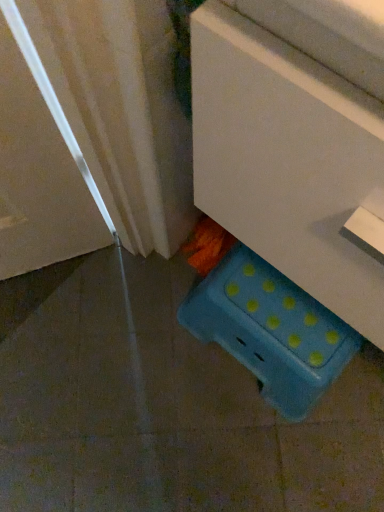
Based on the photo, in order to face blue plastic stool at lower center, should I rotate leftwards or rightwards?

To face it directly, rotate right by 29.602 degrees.

Locate an element on the screen. The height and width of the screenshot is (512, 384). blue plastic stool at lower center is located at coordinates (296, 142).

Describe the element at coordinates (296, 142) in the screenshot. I see `blue plastic stool at lower center` at that location.

Measure the distance between point (208, 339) and camera.

Point (208, 339) and camera are 34.80 inches apart from each other.

Where is `blue polka dot plastic storage box at lower right`? The image size is (384, 512). blue polka dot plastic storage box at lower right is located at coordinates (270, 330).

What do you see at coordinates (270, 330) in the screenshot?
I see `blue polka dot plastic storage box at lower right` at bounding box center [270, 330].

Locate an element on the screen. The image size is (384, 512). blue plastic stool at lower center is located at coordinates (296, 142).

Which object is positioned more to the right, blue polka dot plastic storage box at lower right or blue plastic stool at lower center?

From the viewer's perspective, blue plastic stool at lower center appears more on the right side.

In the image, is blue polka dot plastic storage box at lower right positioned in front of or behind blue plastic stool at lower center?

blue polka dot plastic storage box at lower right is positioned farther from the viewer than blue plastic stool at lower center.

Is point (331, 330) farther from camera compared to point (334, 289)?

Yes, point (331, 330) is behind point (334, 289).

From the image's perspective, which is above, blue polka dot plastic storage box at lower right or blue plastic stool at lower center?

blue plastic stool at lower center.

From a real-world perspective, which object stands above the other?

blue plastic stool at lower center.

Considering the relative sizes of blue polka dot plastic storage box at lower right and blue plastic stool at lower center in the image provided, is blue polka dot plastic storage box at lower right thinner than blue plastic stool at lower center?

Correct, the width of blue polka dot plastic storage box at lower right is less than that of blue plastic stool at lower center.

Can you confirm if blue polka dot plastic storage box at lower right is taller than blue plastic stool at lower center?

No, blue polka dot plastic storage box at lower right is not taller than blue plastic stool at lower center.

Does blue polka dot plastic storage box at lower right have a smaller size compared to blue plastic stool at lower center?

Correct, blue polka dot plastic storage box at lower right occupies less space than blue plastic stool at lower center.

Is blue polka dot plastic storage box at lower right situated inside blue plastic stool at lower center or outside?

blue polka dot plastic storage box at lower right is not enclosed by blue plastic stool at lower center.

Is there a large distance between blue polka dot plastic storage box at lower right and blue plastic stool at lower center?

No, blue polka dot plastic storage box at lower right is not far away from blue plastic stool at lower center.

Is blue polka dot plastic storage box at lower right facing towards blue plastic stool at lower center?

No, blue polka dot plastic storage box at lower right is not aimed at blue plastic stool at lower center.

Can you tell me how much blue polka dot plastic storage box at lower right and blue plastic stool at lower center differ in facing direction?

0.000554 degrees separate the facing orientations of blue polka dot plastic storage box at lower right and blue plastic stool at lower center.

Identify the location of furniture above the blue polka dot plastic storage box at lower right (from a real-world perspective). (296, 142).

Between blue plastic stool at lower center and blue polka dot plastic storage box at lower right, which one appears on the right side from the viewer's perspective?

blue plastic stool at lower center.

Considering the relative positions of blue plastic stool at lower center and blue polka dot plastic storage box at lower right in the image provided, is blue plastic stool at lower center in front of blue polka dot plastic storage box at lower right?

Yes, blue plastic stool at lower center is closer to the camera.

Does point (205, 10) come farther from viewer compared to point (304, 300)?

No, it is not.

From the picture: From the image's perspective, is blue plastic stool at lower center positioned above or below blue polka dot plastic storage box at lower right?

blue plastic stool at lower center is situated higher than blue polka dot plastic storage box at lower right in the image.

From a real-world perspective, who is located higher, blue plastic stool at lower center or blue polka dot plastic storage box at lower right?

From a 3D spatial view, blue plastic stool at lower center is above.

In terms of width, does blue plastic stool at lower center look wider or thinner when compared to blue polka dot plastic storage box at lower right?

blue plastic stool at lower center is wider than blue polka dot plastic storage box at lower right.

Is blue plastic stool at lower center taller or shorter than blue polka dot plastic storage box at lower right?

Clearly, blue plastic stool at lower center is taller compared to blue polka dot plastic storage box at lower right.

Does blue plastic stool at lower center have a smaller size compared to blue polka dot plastic storage box at lower right?

Actually, blue plastic stool at lower center might be larger than blue polka dot plastic storage box at lower right.

Would you say blue plastic stool at lower center is outside blue polka dot plastic storage box at lower right?

Yes, blue plastic stool at lower center is not within blue polka dot plastic storage box at lower right.

Is blue plastic stool at lower center in contact with blue polka dot plastic storage box at lower right?

No.

Is blue plastic stool at lower center oriented away from blue polka dot plastic storage box at lower right?

No.

Locate an element on the screen. This screenshot has height=512, width=384. furniture that appears above the blue polka dot plastic storage box at lower right (from a real-world perspective) is located at coordinates (296, 142).

Locate an element on the screen. The width and height of the screenshot is (384, 512). furniture above the blue polka dot plastic storage box at lower right (from the image's perspective) is located at coordinates (296, 142).

The width and height of the screenshot is (384, 512). I want to click on furniture above the blue polka dot plastic storage box at lower right (from a real-world perspective), so click(296, 142).